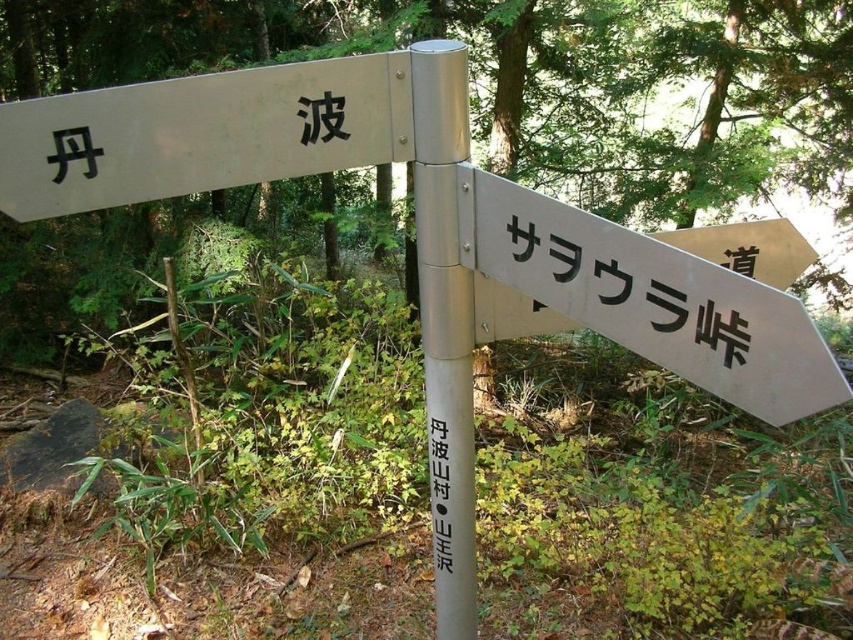
Can you confirm if green leafy tree at center is positioned to the left of white paper sign at center?

Incorrect, green leafy tree at center is not on the left side of white paper sign at center.

Image resolution: width=853 pixels, height=640 pixels. Describe the element at coordinates (514, 81) in the screenshot. I see `green leafy tree at center` at that location.

Locate an element on the screen. green leafy tree at center is located at coordinates (514, 81).

Measure the distance between silver metallic pole at center and white paper sign at center.

silver metallic pole at center and white paper sign at center are 4.59 inches apart.

Which is more to the right, silver metallic pole at center or white paper sign at center?

white paper sign at center

Where is `silver metallic pole at center`? silver metallic pole at center is located at coordinates (445, 324).

Looking at this image, does green leafy tree at center appear under silver metallic sign at center-right?

Actually, green leafy tree at center is above silver metallic sign at center-right.

Does point (537, 88) lie behind point (585, 250)?

Yes, it is behind point (585, 250).

Between point (604, 157) and point (531, 284), which one is positioned in front?

Positioned in front is point (531, 284).

Identify the location of green leafy tree at center. (514, 81).